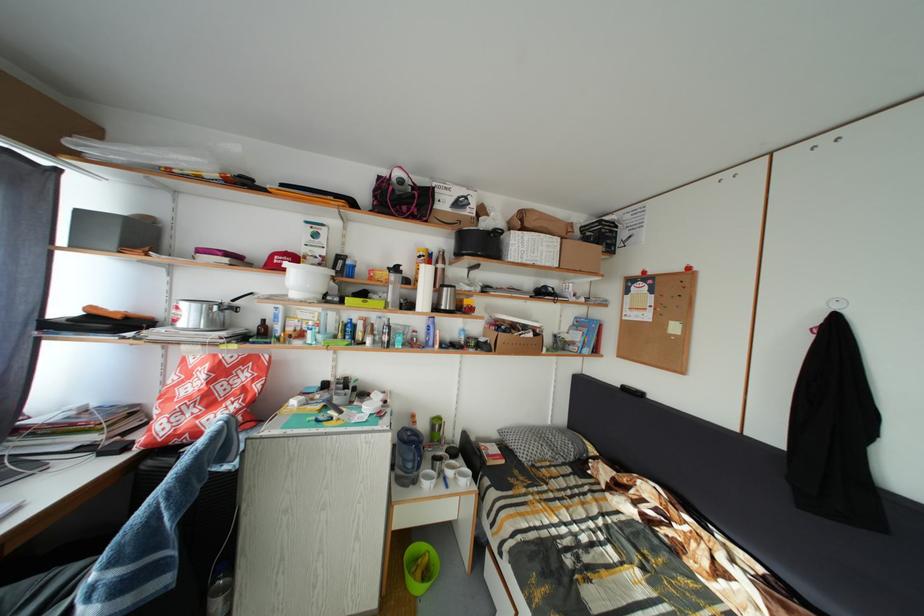
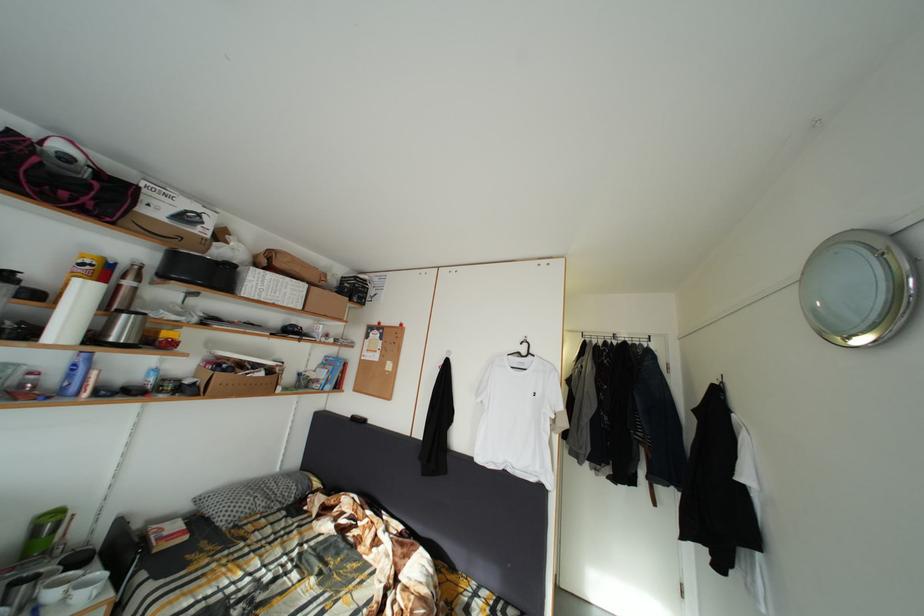
The point at (452, 314) is marked in the first image. Where is the corresponding point in the second image?

(120, 345)